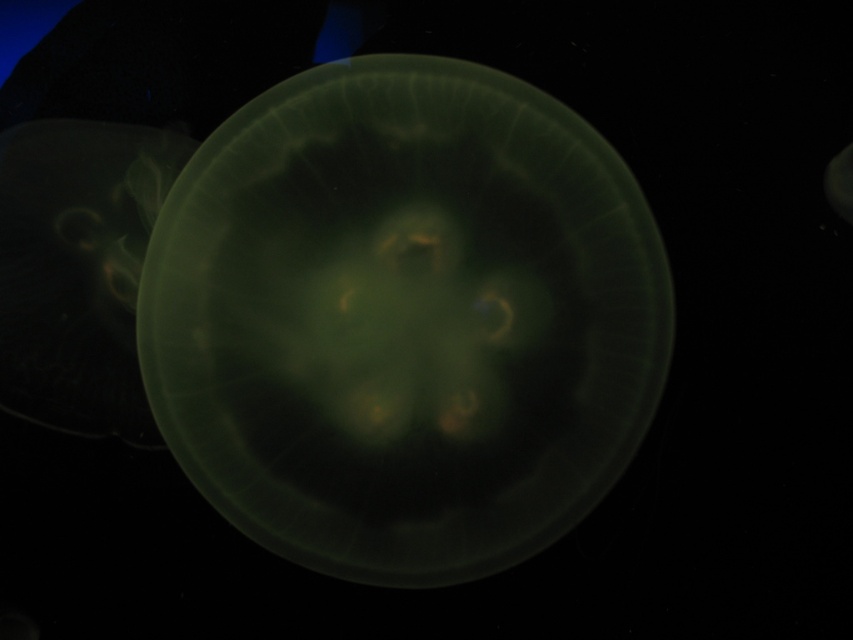
You are a marine biologist observing the jellyfish in the image. You notice two points marked on the image. Point A is at coordinates point [328,412] and Point B is at coordinates point [103,342]. Which point is closer to the front of the jellyfish?

Point B at point [103,342] is closer to the front of the jellyfish because it is in front of point A at point [328,412].

You are an underwater explorer observing the scene. You see a translucent green jellyfish at center and a translucent green jellyfish at left. Which jellyfish is positioned to the right of the other?

The translucent green jellyfish at center is positioned to the right of the translucent green jellyfish at left.

You are scuba diving and see the translucent green jellyfish at center. If you want to take a photo without getting too close, what is the minimum distance you should maintain to ensure the jellyfish remains in focus?

The minimum distance you should maintain to ensure the translucent green jellyfish at center remains in focus is 4.21 feet, as it is the closest point to the viewer.